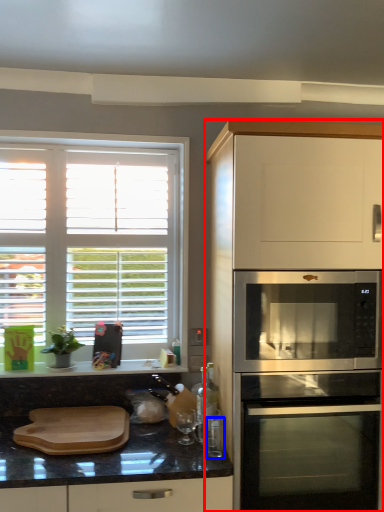
Question: Which point is closer to the camera, cabinetry (highlighted by a red box) or appliance (highlighted by a blue box)?

Choices:
 (A) cabinetry
 (B) appliance

Answer: (A)